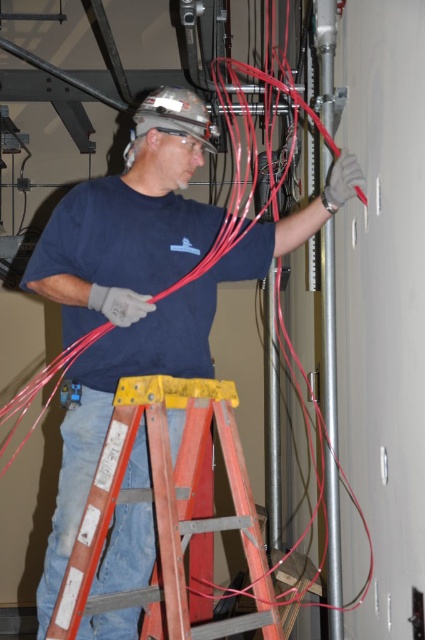
Which of these two, matte black shirt at center or red wood ladder at center, stands taller?

Standing taller between the two is matte black shirt at center.

Does matte black shirt at center come in front of red wood ladder at center?

That is False.

Is point (269, 266) positioned after point (161, 564)?

Yes, it is behind point (161, 564).

This screenshot has width=425, height=640. I want to click on matte black shirt at center, so click(x=144, y=284).